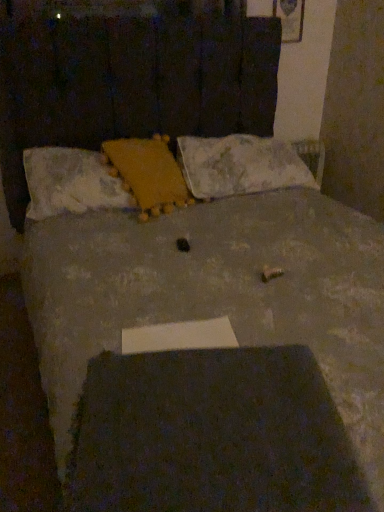
Question: Can you confirm if fluffy white pillow at upper left, which is the first pillow in left-to-right order, is bigger than white soft pillow at center, the 3th pillow when ordered from left to right?

Choices:
 (A) no
 (B) yes

Answer: (A)

Question: From a real-world perspective, does fluffy white pillow at upper left, placed as the third pillow when sorted from right to left, sit lower than white soft pillow at center, the 3th pillow when ordered from left to right?

Choices:
 (A) no
 (B) yes

Answer: (A)

Question: Considering the relative positions of fluffy white pillow at upper left, which is the first pillow in left-to-right order, and white soft pillow at center, the 1th pillow in the right-to-left sequence, in the image provided, is fluffy white pillow at upper left, which is the first pillow in left-to-right order, to the right of white soft pillow at center, the 1th pillow in the right-to-left sequence, from the viewer's perspective?

Choices:
 (A) no
 (B) yes

Answer: (A)

Question: Would you consider fluffy white pillow at upper left, which is the first pillow in left-to-right order, to be distant from white soft pillow at center, the 3th pillow when ordered from left to right?

Choices:
 (A) yes
 (B) no

Answer: (B)

Question: Is the position of fluffy white pillow at upper left, which is the first pillow in left-to-right order, more distant than that of white soft pillow at center, the 3th pillow when ordered from left to right?

Choices:
 (A) no
 (B) yes

Answer: (A)

Question: Is fluffy white pillow at upper left, placed as the third pillow when sorted from right to left, smaller than white soft pillow at center, the 1th pillow in the right-to-left sequence?

Choices:
 (A) no
 (B) yes

Answer: (B)

Question: From a real-world perspective, is white soft pillow at center, the 1th pillow in the right-to-left sequence, located beneath yellow fuzzy pillow at upper center, acting as the second pillow starting from the left?

Choices:
 (A) no
 (B) yes

Answer: (B)

Question: Is white soft pillow at center, the 1th pillow in the right-to-left sequence, smaller than yellow fuzzy pillow at upper center, acting as the second pillow starting from the left?

Choices:
 (A) no
 (B) yes

Answer: (A)

Question: Does white soft pillow at center, the 1th pillow in the right-to-left sequence, appear on the left side of yellow fuzzy pillow at upper center, placed as the 2th pillow when sorted from right to left?

Choices:
 (A) no
 (B) yes

Answer: (A)

Question: Can you see white soft pillow at center, the 1th pillow in the right-to-left sequence, touching yellow fuzzy pillow at upper center, acting as the second pillow starting from the left?

Choices:
 (A) yes
 (B) no

Answer: (B)

Question: Does white soft pillow at center, the 1th pillow in the right-to-left sequence, contain yellow fuzzy pillow at upper center, placed as the 2th pillow when sorted from right to left?

Choices:
 (A) no
 (B) yes

Answer: (A)

Question: Is white soft pillow at center, the 3th pillow when ordered from left to right, far away from yellow fuzzy pillow at upper center, placed as the 2th pillow when sorted from right to left?

Choices:
 (A) no
 (B) yes

Answer: (A)

Question: Considering the relative positions of fluffy white pillow at upper left, placed as the third pillow when sorted from right to left, and yellow fuzzy pillow at upper center, placed as the 2th pillow when sorted from right to left, in the image provided, is fluffy white pillow at upper left, placed as the third pillow when sorted from right to left, to the left of yellow fuzzy pillow at upper center, placed as the 2th pillow when sorted from right to left, from the viewer's perspective?

Choices:
 (A) no
 (B) yes

Answer: (B)